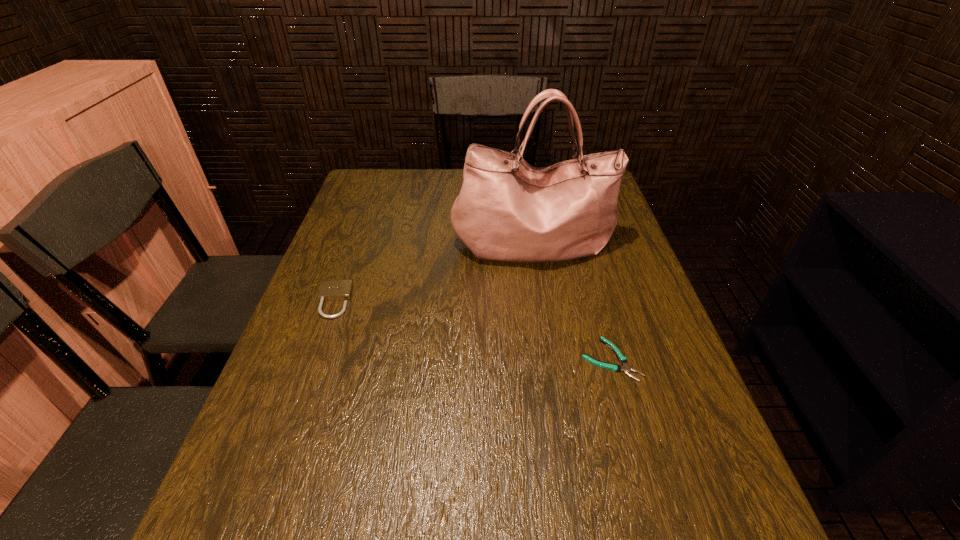
You are a GUI agent. You are given a task and a screenshot of the screen. Output one action in this format:
    pyautogui.click(x=<x>, y=<y>)
    Task: Click on the vacant position in the image that satisfies the following two spatial constraints: 1. at the front of the tallest object with handles; 2. on the left side of the pliers
    Image resolution: width=960 pixels, height=540 pixels.
    Given the screenshot: What is the action you would take?
    pyautogui.click(x=552, y=359)